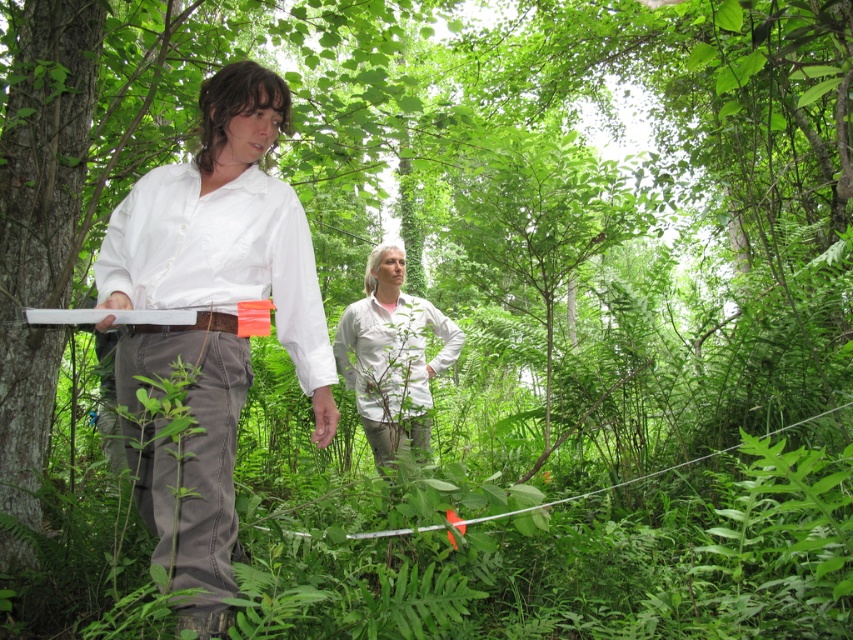
You are planning to place a 6 feet long wooden bench between the white cotton shirt at center and the white matte shirt at center. Can the bench fit between them?

The distance between the white cotton shirt at center and the white matte shirt at center is 6.76 feet, so a 6 feet long bench can fit between them with some space remaining.

You are a hiker trying to locate two people in the forest. You see the white matte shirt at left and the white matte shirt at center. Which one is higher up in the image?

The white matte shirt at left is located above the white matte shirt at center, so the white matte shirt at left is higher up in the image.

You are a hiker trying to determine which of the two people in the forest is closer to you. You see the white matte shirt at left and the white matte shirt at center. Based on their size in the image, which one is nearer to you?

The white matte shirt at left is closer to you because it occupies less space than the white matte shirt at center, indicating it is nearer in the image.